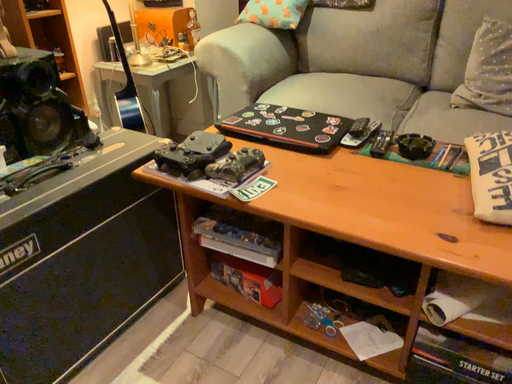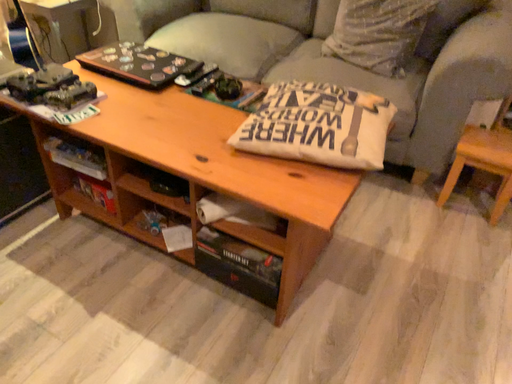
Question: How did the camera likely rotate when shooting the video?

Choices:
 (A) rotated upward
 (B) rotated downward

Answer: (B)